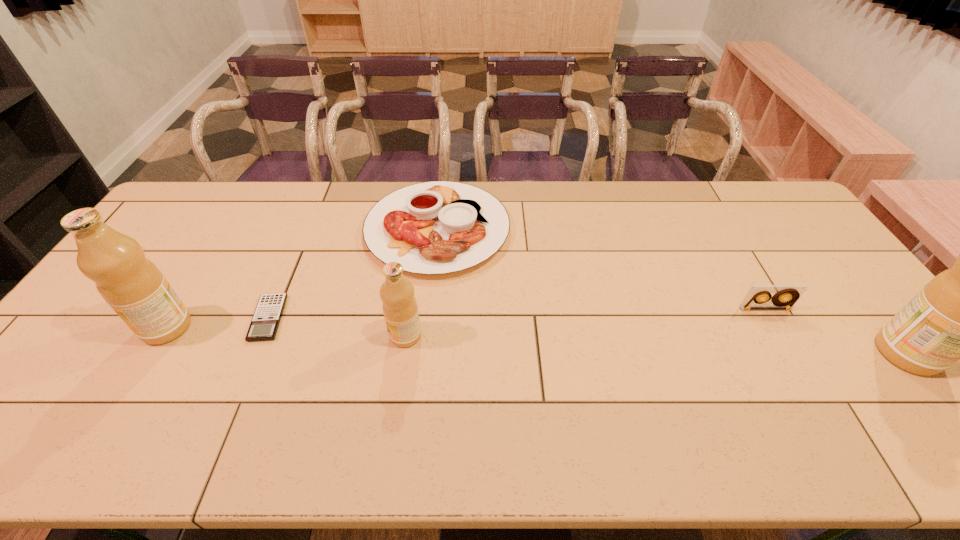
Where is `object at the right edge`? This screenshot has width=960, height=540. object at the right edge is located at coordinates (958, 315).

Identify the location of object positioned at the near right corner. The image size is (960, 540). (958, 315).

The image size is (960, 540). In the image, there is a desktop. Find the location of `vacant space at the far edge`. vacant space at the far edge is located at coordinates (534, 214).

Where is `vacant space at the near edge of the desktop`? vacant space at the near edge of the desktop is located at coordinates (356, 393).

In the image, there is a desktop. Identify the location of free space at the right edge. The height and width of the screenshot is (540, 960). (858, 308).

The width and height of the screenshot is (960, 540). Identify the location of vacant space at the far left corner of the desktop. (189, 204).

Identify the location of vacant space at the far right corner of the desktop. (777, 219).

Find the location of `free space between the platter and the shortest olive oil`. free space between the platter and the shortest olive oil is located at coordinates (421, 282).

Identify the location of free space between the calculator and the shortest olive oil. (337, 327).

What are the coordinates of `empty space that is in between the videotape and the second shortest object` in the screenshot? It's located at [601, 269].